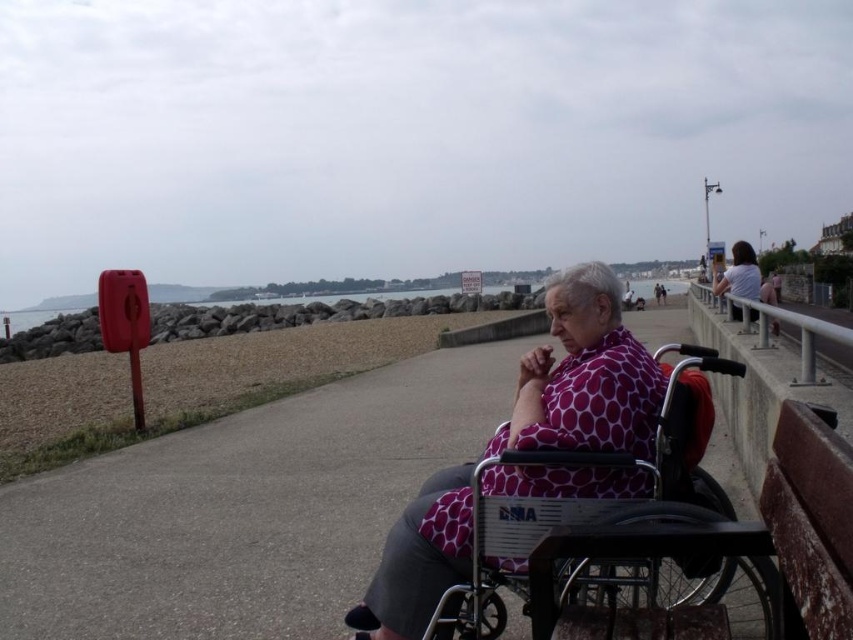
Can you confirm if concrete at center is taller than polka dot fabric at center?

In fact, concrete at center may be shorter than polka dot fabric at center.

The width and height of the screenshot is (853, 640). Describe the element at coordinates (242, 509) in the screenshot. I see `concrete at center` at that location.

Identify the location of concrete at center. The height and width of the screenshot is (640, 853). (242, 509).

Between concrete at center and metallic silver wheelchair at center, which one has less height?

metallic silver wheelchair at center

Does concrete at center have a smaller size compared to metallic silver wheelchair at center?

Actually, concrete at center might be larger than metallic silver wheelchair at center.

What do you see at coordinates (242, 509) in the screenshot? The width and height of the screenshot is (853, 640). I see `concrete at center` at bounding box center [242, 509].

Find the location of a particular element. The width and height of the screenshot is (853, 640). concrete at center is located at coordinates (242, 509).

Who is shorter, polka dot fabric at center or metallic silver wheelchair at center?

metallic silver wheelchair at center is shorter.

The height and width of the screenshot is (640, 853). What do you see at coordinates (584, 376) in the screenshot? I see `polka dot fabric at center` at bounding box center [584, 376].

The width and height of the screenshot is (853, 640). Identify the location of polka dot fabric at center. (584, 376).